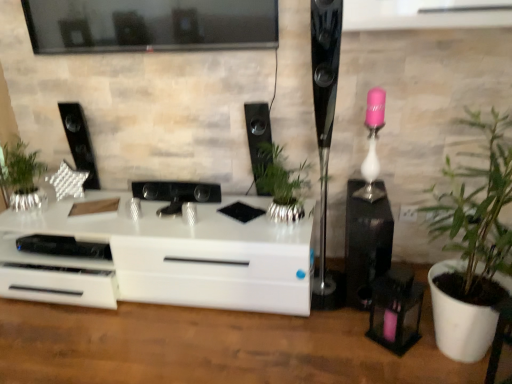
How much space does silver metallic plant pot at center, the second houseplant in the right-to-left sequence, occupy horizontally?

The width of silver metallic plant pot at center, the second houseplant in the right-to-left sequence, is 12.39 inches.

Locate an element on the screen. white glossy chest of drawers at center is located at coordinates (184, 254).

What do you see at coordinates (184, 254) in the screenshot? The image size is (512, 384). I see `white glossy chest of drawers at center` at bounding box center [184, 254].

This screenshot has height=384, width=512. Describe the element at coordinates (473, 247) in the screenshot. I see `green leafy plant at right, the 1th houseplant when ordered from right to left` at that location.

Where is `black textured speaker at left, the 1th speaker viewed from the left`? black textured speaker at left, the 1th speaker viewed from the left is located at coordinates (79, 142).

Locate an element on the screen. silver metallic plant at left, the third houseplant when ordered from right to left is located at coordinates (22, 177).

Locate an element on the screen. Image resolution: width=512 pixels, height=384 pixels. silver metallic plant pot at center, the second houseplant in the right-to-left sequence is located at coordinates (282, 183).

Is black glossy speaker at center, which appears as the 2th speaker when viewed from the left, facing away from black textured speaker at left, arranged as the fourth speaker when viewed from the right?

No.

How much distance is there between black glossy speaker at center, which ranks as the 3th speaker in right-to-left order, and black textured speaker at left, the 1th speaker viewed from the left?

black glossy speaker at center, which ranks as the 3th speaker in right-to-left order, and black textured speaker at left, the 1th speaker viewed from the left, are 84.22 centimeters apart from each other.

Considering the relative sizes of black glossy speaker at center, which appears as the 2th speaker when viewed from the left, and black textured speaker at left, the 1th speaker viewed from the left, in the image provided, is black glossy speaker at center, which appears as the 2th speaker when viewed from the left, smaller than black textured speaker at left, the 1th speaker viewed from the left,?

Incorrect, black glossy speaker at center, which appears as the 2th speaker when viewed from the left, is not smaller in size than black textured speaker at left, the 1th speaker viewed from the left.

Does black glossy speaker at center, which ranks as the 3th speaker in right-to-left order, have a lesser width compared to black textured speaker at left, the 1th speaker viewed from the left?

No, black glossy speaker at center, which ranks as the 3th speaker in right-to-left order, is not thinner than black textured speaker at left, the 1th speaker viewed from the left.

From the image's perspective, which one is positioned higher, black glossy speaker at center, which ranks as the 3th speaker in right-to-left order, or polished black speaker at right, the third speaker viewed from the left?

black glossy speaker at center, which ranks as the 3th speaker in right-to-left order, is shown above in the image.

Which object is positioned more to the right, black glossy speaker at center, which ranks as the 3th speaker in right-to-left order, or polished black speaker at right, the third speaker viewed from the left?

From the viewer's perspective, polished black speaker at right, the third speaker viewed from the left, appears more on the right side.

Considering the relative sizes of black glossy speaker at center, which appears as the 2th speaker when viewed from the left, and polished black speaker at right, the third speaker viewed from the left, in the image provided, is black glossy speaker at center, which appears as the 2th speaker when viewed from the left, bigger than polished black speaker at right, the third speaker viewed from the left,?

Incorrect, black glossy speaker at center, which appears as the 2th speaker when viewed from the left, is not larger than polished black speaker at right, the third speaker viewed from the left.

Consider the image. Is silver metallic plant pot at center, acting as the 2th houseplant starting from the left, bigger or smaller than white glossy chest of drawers at center?

silver metallic plant pot at center, acting as the 2th houseplant starting from the left, is smaller than white glossy chest of drawers at center.

Is the position of silver metallic plant pot at center, the second houseplant in the right-to-left sequence, more distant than that of white glossy chest of drawers at center?

No, silver metallic plant pot at center, the second houseplant in the right-to-left sequence, is in front of white glossy chest of drawers at center.

From the image's perspective, who appears lower, silver metallic plant pot at center, acting as the 2th houseplant starting from the left, or white glossy chest of drawers at center?

white glossy chest of drawers at center.

Considering the sizes of objects silver metallic plant pot at center, the second houseplant in the right-to-left sequence, and white glossy chest of drawers at center in the image provided, who is thinner, silver metallic plant pot at center, the second houseplant in the right-to-left sequence, or white glossy chest of drawers at center?

silver metallic plant pot at center, the second houseplant in the right-to-left sequence.

Does green leafy plant at right, the 1th houseplant when ordered from right to left, appear on the right side of black glossy speaker at center, which appears as the 2th speaker when viewed from the left?

Indeed, green leafy plant at right, the 1th houseplant when ordered from right to left, is positioned on the right side of black glossy speaker at center, which appears as the 2th speaker when viewed from the left.

Consider the image. Is green leafy plant at right, the 1th houseplant when ordered from right to left, looking in the opposite direction of black glossy speaker at center, which ranks as the 3th speaker in right-to-left order?

green leafy plant at right, the 1th houseplant when ordered from right to left, is not turned away from black glossy speaker at center, which ranks as the 3th speaker in right-to-left order.

Can you confirm if green leafy plant at right, the 1th houseplant when ordered from right to left, is bigger than black glossy speaker at center, which appears as the 2th speaker when viewed from the left?

Yes.

Based on the photo, from the image's perspective, would you say green leafy plant at right, which is counted as the 3th houseplant, starting from the left, is shown under black glossy speaker at center, which appears as the 2th speaker when viewed from the left?

Yes.

Which point is more distant from viewer, (18, 158) or (91, 186)?

The point (91, 186) is farther from the camera.

From a real-world perspective, count 1st houseplants downward from the black textured speaker at left, arranged as the fourth speaker when viewed from the right, and point to it. Please provide its 2D coordinates.

[(22, 177)]

Which object is closer to the camera, silver metallic plant at left, which ranks as the 1th houseplant in left-to-right order, or black textured speaker at left, the 1th speaker viewed from the left?

silver metallic plant at left, which ranks as the 1th houseplant in left-to-right order, is more forward.

In the scene shown: Considering the sizes of objects silver metallic plant at left, which ranks as the 1th houseplant in left-to-right order, and black textured speaker at left, arranged as the fourth speaker when viewed from the right, in the image provided, who is smaller, silver metallic plant at left, which ranks as the 1th houseplant in left-to-right order, or black textured speaker at left, arranged as the fourth speaker when viewed from the right,?

black textured speaker at left, arranged as the fourth speaker when viewed from the right, is smaller.

From the green leafy plant at right, which is counted as the 3th houseplant, starting from the left, count the 1st houseplant to the left and point to it. Please provide its 2D coordinates.

[(282, 183)]

Looking at this image, can you confirm if green leafy plant at right, which is counted as the 3th houseplant, starting from the left, is taller than silver metallic plant pot at center, acting as the 2th houseplant starting from the left?

Yes, green leafy plant at right, which is counted as the 3th houseplant, starting from the left, is taller than silver metallic plant pot at center, acting as the 2th houseplant starting from the left.

From the image's perspective, is green leafy plant at right, which is counted as the 3th houseplant, starting from the left, beneath silver metallic plant pot at center, acting as the 2th houseplant starting from the left?

Indeed, from the image's perspective, green leafy plant at right, which is counted as the 3th houseplant, starting from the left, is shown beneath silver metallic plant pot at center, acting as the 2th houseplant starting from the left.

Is green leafy plant at right, which is counted as the 3th houseplant, starting from the left, not inside silver metallic plant pot at center, the second houseplant in the right-to-left sequence?

Absolutely, green leafy plant at right, which is counted as the 3th houseplant, starting from the left, is external to silver metallic plant pot at center, the second houseplant in the right-to-left sequence.

How many degrees apart are the facing directions of black glossy speaker at right, which ranks as the 4th speaker in left-to-right order, and black glossy speaker at center, which ranks as the 3th speaker in right-to-left order?

The facing directions of black glossy speaker at right, which ranks as the 4th speaker in left-to-right order, and black glossy speaker at center, which ranks as the 3th speaker in right-to-left order, are 1.11 degrees apart.

Who is bigger, black glossy speaker at right, which ranks as the 4th speaker in left-to-right order, or black glossy speaker at center, which ranks as the 3th speaker in right-to-left order?

Bigger between the two is black glossy speaker at right, which ranks as the 4th speaker in left-to-right order.

Locate an element on the screen. the 2nd speaker above when counting from the black glossy speaker at right, which ranks as the 4th speaker in left-to-right order (from the image's perspective) is located at coordinates pyautogui.click(x=257, y=131).

Does point (376, 210) lie behind point (253, 136)?

That is False.

I want to click on speaker located above the black glossy speaker at center, which ranks as the 3th speaker in right-to-left order (from the image's perspective), so click(x=79, y=142).

Which speaker is the 1st one when counting from the left side of the polished black speaker at right, acting as the second speaker starting from the right? Please provide its 2D coordinates.

[(257, 131)]

Estimate the real-world distances between objects in this image. Which object is further from black glossy speaker at right, the 1th speaker viewed from the right, polished black speaker at right, the third speaker viewed from the left, or white glossy chest of drawers at center?

white glossy chest of drawers at center.

From the image, which object appears to be nearer to silver metallic plant pot at center, acting as the 2th houseplant starting from the left, polished black speaker at right, the third speaker viewed from the left, or green leafy plant at right, which is counted as the 3th houseplant, starting from the left?

polished black speaker at right, the third speaker viewed from the left, is positioned closer to the anchor silver metallic plant pot at center, acting as the 2th houseplant starting from the left.

Based on their spatial positions, is polished black speaker at right, the third speaker viewed from the left, or black glossy speaker at right, the 1th speaker viewed from the right, closer to black textured speaker at left, arranged as the fourth speaker when viewed from the right?

polished black speaker at right, the third speaker viewed from the left, is positioned closer to the anchor black textured speaker at left, arranged as the fourth speaker when viewed from the right.

Based on the photo, from the image, which object appears to be nearer to silver metallic plant at left, which ranks as the 1th houseplant in left-to-right order, black textured speaker at left, the 1th speaker viewed from the left, or polished black speaker at right, acting as the second speaker starting from the right?

Among the two, black textured speaker at left, the 1th speaker viewed from the left, is located nearer to silver metallic plant at left, which ranks as the 1th houseplant in left-to-right order.

When comparing their distances from black glossy speaker at right, which ranks as the 4th speaker in left-to-right order, does polished black speaker at right, the third speaker viewed from the left, or black glossy speaker at center, which ranks as the 3th speaker in right-to-left order, seem further?

Based on the image, black glossy speaker at center, which ranks as the 3th speaker in right-to-left order, appears to be further to black glossy speaker at right, which ranks as the 4th speaker in left-to-right order.

Looking at the image, which one is located further to green leafy plant at right, the 1th houseplant when ordered from right to left, black glossy speaker at center, which appears as the 2th speaker when viewed from the left, or polished black speaker at right, acting as the second speaker starting from the right?

Based on the image, black glossy speaker at center, which appears as the 2th speaker when viewed from the left, appears to be further to green leafy plant at right, the 1th houseplant when ordered from right to left.

Estimate the real-world distances between objects in this image. Which object is further from polished black speaker at right, the third speaker viewed from the left, green leafy plant at right, the 1th houseplant when ordered from right to left, or black glossy speaker at right, the 1th speaker viewed from the right?

green leafy plant at right, the 1th houseplant when ordered from right to left, is positioned further to the anchor polished black speaker at right, the third speaker viewed from the left.

Looking at the image, which one is located further to black glossy speaker at center, which ranks as the 3th speaker in right-to-left order, silver metallic plant at left, which ranks as the 1th houseplant in left-to-right order, or silver metallic plant pot at center, the second houseplant in the right-to-left sequence?

silver metallic plant at left, which ranks as the 1th houseplant in left-to-right order.

Where is `houseplant located between black glossy speaker at center, which appears as the 2th speaker when viewed from the left, and green leafy plant at right, which is counted as the 3th houseplant, starting from the left, in the left-right direction`? houseplant located between black glossy speaker at center, which appears as the 2th speaker when viewed from the left, and green leafy plant at right, which is counted as the 3th houseplant, starting from the left, in the left-right direction is located at coordinates point(282,183).

Identify the location of houseplant located between black textured speaker at left, arranged as the fourth speaker when viewed from the right, and green leafy plant at right, the 1th houseplant when ordered from right to left, in the left-right direction. (282, 183).

Image resolution: width=512 pixels, height=384 pixels. I want to click on houseplant between black glossy speaker at center, which appears as the 2th speaker when viewed from the left, and black glossy speaker at right, the 1th speaker viewed from the right, in the horizontal direction, so click(x=282, y=183).

The width and height of the screenshot is (512, 384). I want to click on chest of drawers between silver metallic plant at left, the third houseplant when ordered from right to left, and silver metallic plant pot at center, acting as the 2th houseplant starting from the left, in the horizontal direction, so click(x=184, y=254).